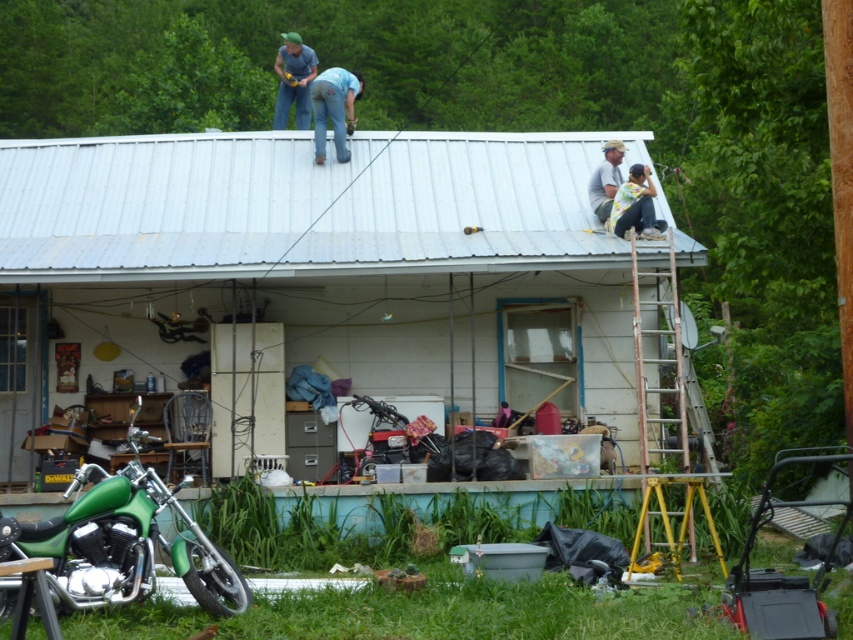
You are a delivery person who needs to park your green matte motorcycle at lower left without blocking the white cotton shirt at upper right. Based on their positions, can you safely park the motorcycle there?

The green matte motorcycle at lower left is below the white cotton shirt at upper right, so parking it there would not block the white cotton shirt at upper right as they are positioned vertically apart.

You are standing on the porch of the house and need to reach the blue denim jeans at upper center. Which direction should you move relative to the rusty metal ladder at right?

The rusty metal ladder at right is to the right of the blue denim jeans at upper center, so to reach the blue denim jeans at upper center, you should move to the left of the rusty metal ladder at right.

You are standing on the porch of the house and need to move the white cotton shirt at upper right to the right side of the green matte motorcycle at lower left. Is this possible without moving the motorcycle?

The green matte motorcycle at lower left is already to the left of the white cotton shirt at upper right, so moving the white cotton shirt at upper right to the right of the green matte motorcycle at lower left would require placing it further to the left, which contradicts the desired direction. Therefore, it is not possible to move the white cotton shirt at upper right to the right side of the green matte motorcycle at lower left without moving the motorcycle.